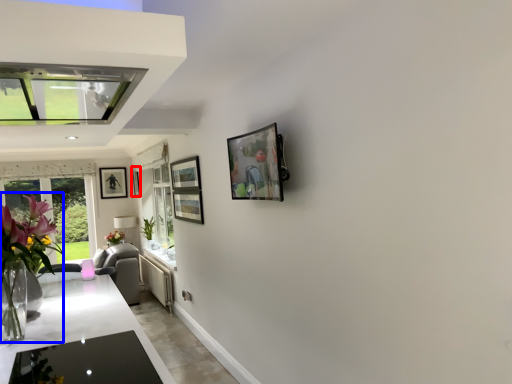
Question: Which object appears closest to the camera in this image, picture frame (highlighted by a red box) or floral arrangement (highlighted by a blue box)?

Choices:
 (A) picture frame
 (B) floral arrangement

Answer: (B)